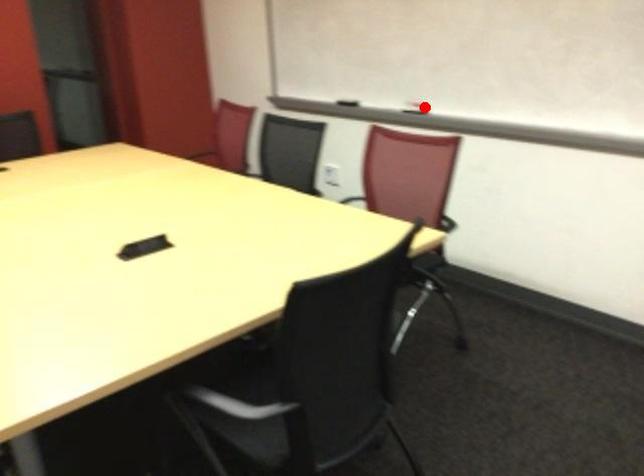
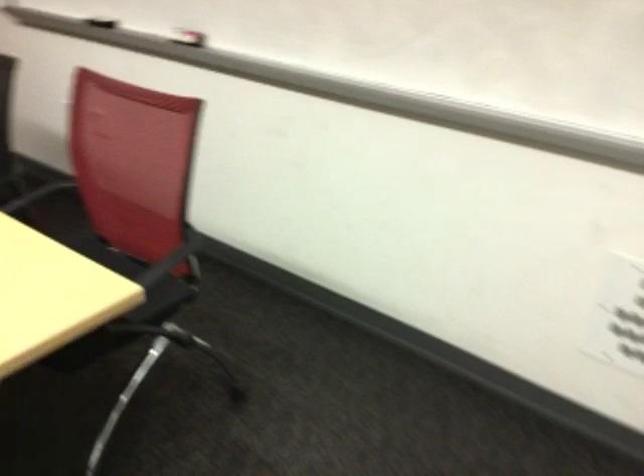
In the second image, find the point that corresponds to the highlighted location in the first image.

(196, 43)